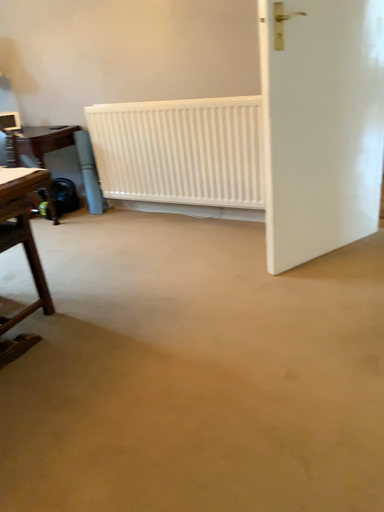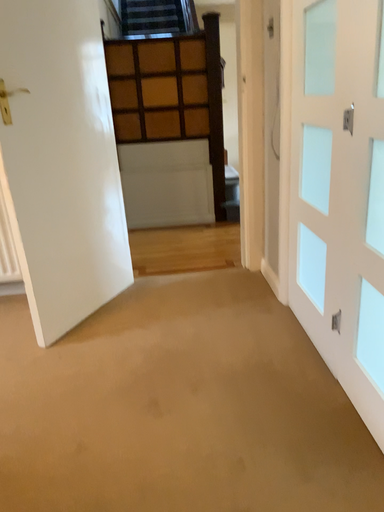
Question: How did the camera likely rotate when shooting the video?

Choices:
 (A) rotated left
 (B) rotated right

Answer: (B)